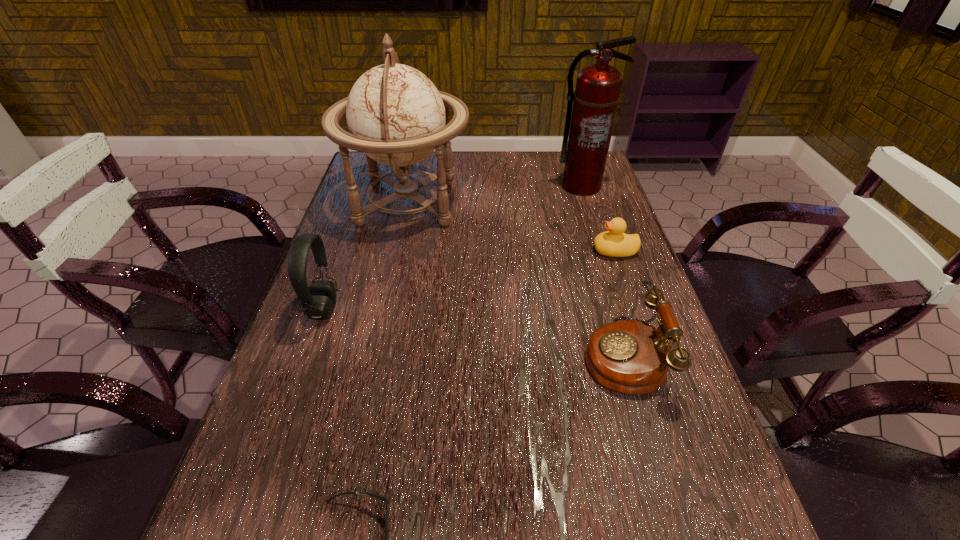
I want to click on globe, so click(396, 116).

Locate an element on the screen. This screenshot has width=960, height=540. fire extinguisher is located at coordinates (597, 93).

Where is `headset`? headset is located at coordinates (318, 299).

I want to click on telephone, so [632, 357].

Where is `duck`? duck is located at coordinates (614, 243).

Locate an element on the screen. the fourth nearest object is located at coordinates (614, 243).

Image resolution: width=960 pixels, height=540 pixels. I want to click on vacant space located 0.050m at the front of the globe showing Africa, so click(488, 200).

Where is `free space located on the nozzle side of the fire extinguisher`? free space located on the nozzle side of the fire extinguisher is located at coordinates (604, 261).

I want to click on free space located 0.190m on the front-facing side of the fourth shortest object, so click(x=423, y=309).

Locate an element on the screen. free space located on the dial of the fourth tallest object is located at coordinates (518, 354).